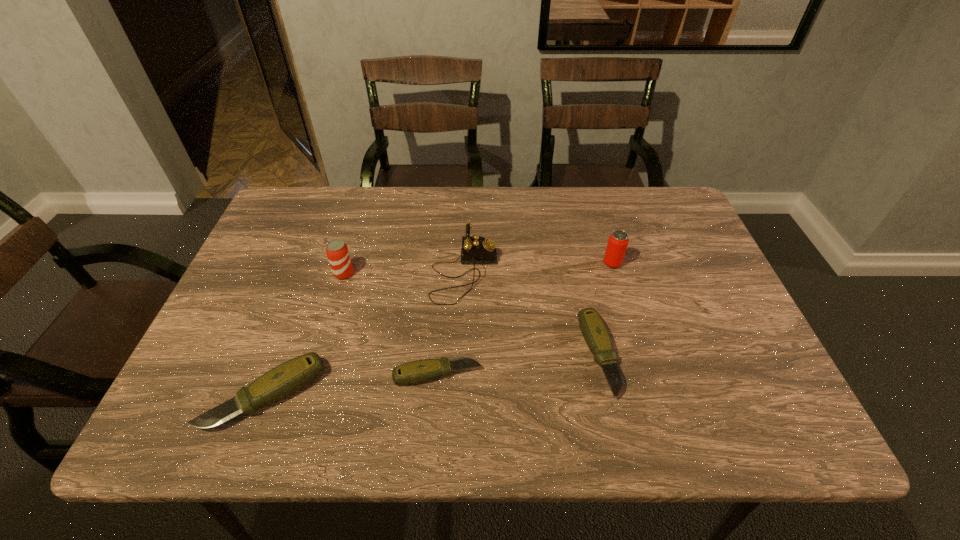
In order to click on vacant position in the image that satisfies the following two spatial constraints: 1. on the back side of the left beer can; 2. on the left side of the rightmost object in this screenshot , I will do `click(348, 263)`.